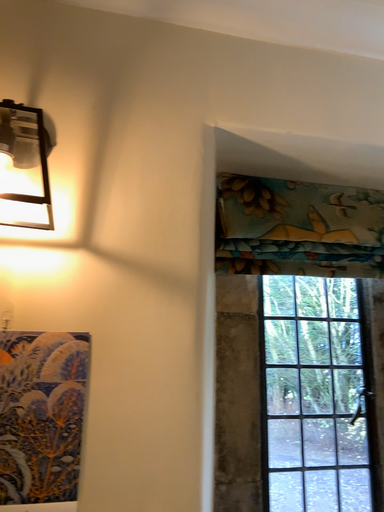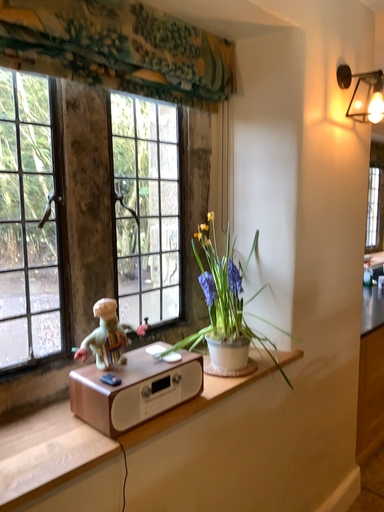
Question: Which way did the camera rotate in the video?

Choices:
 (A) rotated left
 (B) rotated right

Answer: (B)